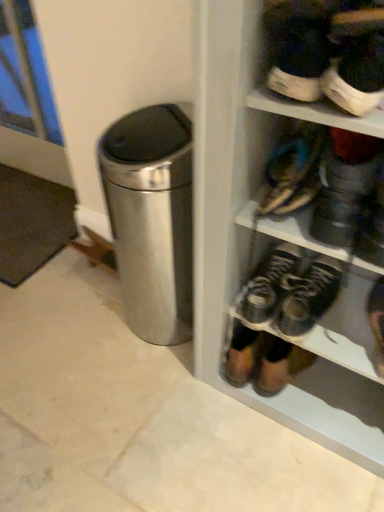
Find the location of a particular element. Image resolution: width=384 pixels, height=512 pixels. free point below leather shoe at lower right, the first footwear ordered from the bottom (from a real-world perspective) is located at coordinates (365, 406).